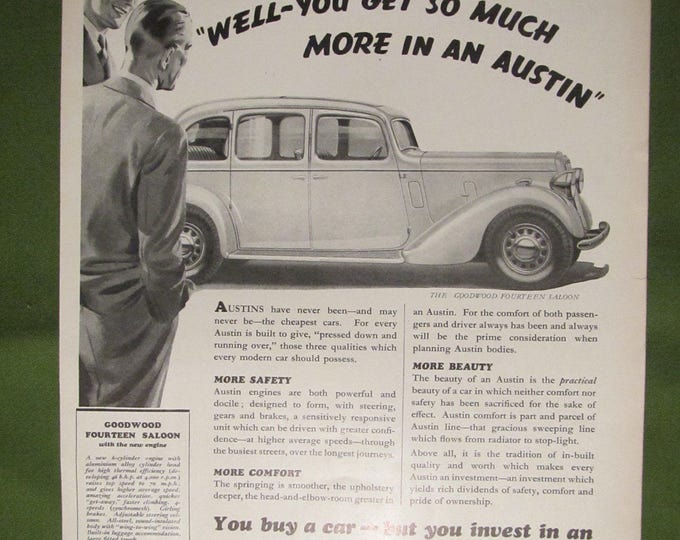
The height and width of the screenshot is (540, 680). Find the location of `door`. door is located at coordinates (275, 206), (336, 232).